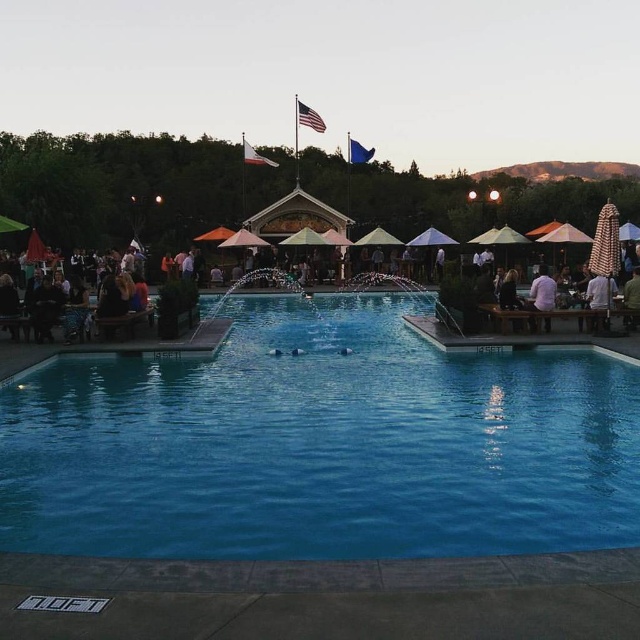
Question: Among these points, which one is farthest from the camera?

Choices:
 (A) (109, 317)
 (B) (232, 547)

Answer: (A)

Question: Can you confirm if blue smooth pool at center is bigger than matte wooden tables at lower left?

Choices:
 (A) no
 (B) yes

Answer: (A)

Question: Which of the following is the farthest from the observer?

Choices:
 (A) (490, 333)
 (B) (102, 403)

Answer: (A)

Question: Is blue smooth pool at center smaller than matte wooden tables at lower left?

Choices:
 (A) yes
 (B) no

Answer: (A)

Question: Among these points, which one is farthest from the camera?

Choices:
 (A) (60, 492)
 (B) (612, 220)

Answer: (B)

Question: Does blue smooth pool at center lie behind matte wooden tables at lower left?

Choices:
 (A) no
 (B) yes

Answer: (A)